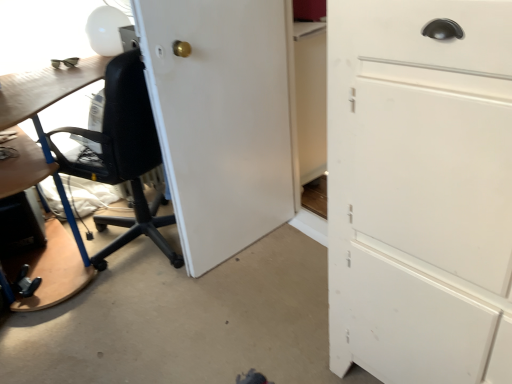
Question: Does black mesh chair at left have a larger size compared to white matte cabinet at right?

Choices:
 (A) yes
 (B) no

Answer: (A)

Question: From a real-world perspective, does black mesh chair at left stand above white matte cabinet at right?

Choices:
 (A) yes
 (B) no

Answer: (B)

Question: Is black mesh chair at left outside of white matte cabinet at right?

Choices:
 (A) no
 (B) yes

Answer: (B)

Question: Is black mesh chair at left taller than white matte cabinet at right?

Choices:
 (A) yes
 (B) no

Answer: (B)

Question: Is black mesh chair at left surrounding white matte cabinet at right?

Choices:
 (A) yes
 (B) no

Answer: (B)

Question: Does black mesh chair at left come in front of white matte cabinet at right?

Choices:
 (A) no
 (B) yes

Answer: (A)

Question: From the image's perspective, is white glossy table lamp at upper left over white matte door at center?

Choices:
 (A) yes
 (B) no

Answer: (A)

Question: Is white glossy table lamp at upper left at the right side of white matte door at center?

Choices:
 (A) no
 (B) yes

Answer: (A)

Question: Would you consider white glossy table lamp at upper left to be distant from white matte door at center?

Choices:
 (A) yes
 (B) no

Answer: (B)

Question: From a real-world perspective, is white glossy table lamp at upper left positioned under white matte door at center based on gravity?

Choices:
 (A) no
 (B) yes

Answer: (A)

Question: Is white glossy table lamp at upper left taller than white matte door at center?

Choices:
 (A) yes
 (B) no

Answer: (B)

Question: Would you say white matte door at center is part of white glossy table lamp at upper left's contents?

Choices:
 (A) yes
 (B) no

Answer: (B)

Question: Is white glossy table lamp at upper left at the left side of white matte cabinet at right?

Choices:
 (A) yes
 (B) no

Answer: (A)